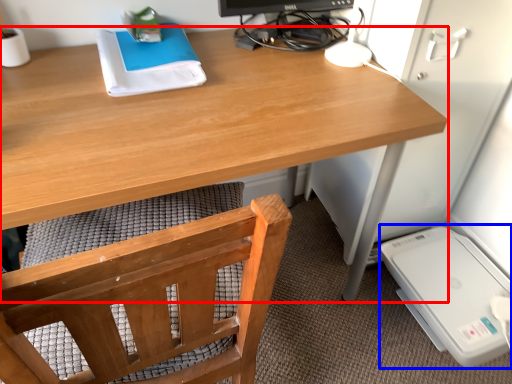
Question: Which object is closer to the camera taking this photo, desk (highlighted by a red box) or appliance (highlighted by a blue box)?

Choices:
 (A) desk
 (B) appliance

Answer: (A)